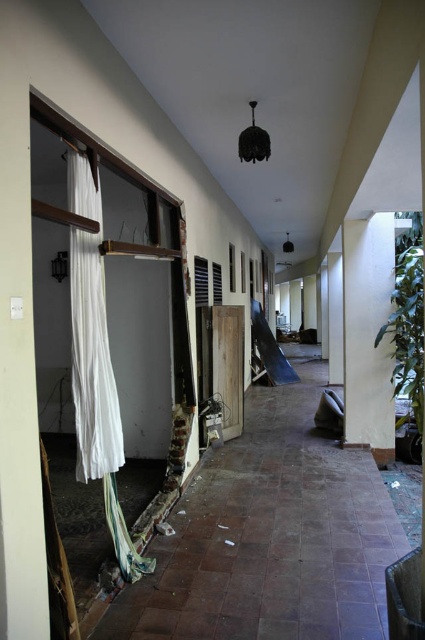
You are standing in the corridor and need to reach the exit located at the far end. There is a white fabric curtain at left. Is the curtain in your way if you walk straight towards the exit?

The white fabric curtain at left is positioned at point (96, 365), which is to the left side of the corridor. Since you are walking straight towards the exit, the curtain will not be directly in your path and therefore will not block your way.

You are a painter needing to hang a 2.5 meter tall canvas. You see the white fabric curtain at left and the green textured pillar at right in the corridor. Which object can accommodate the canvas height?

The green textured pillar at right has a greater height than the white fabric curtain at left, so it can accommodate the 2.5 meter tall canvas.

You are a maintenance worker with a 3.5 meter long ladder. You need to place the ladder between the white fabric curtain at left and the green textured pillar at right. Based on the scene, will the ladder fit horizontally between them?

The distance between the white fabric curtain at left and the green textured pillar at right is 3.29 meters. Since the ladder is 3.5 meters long, it will not fit horizontally between them as the space is shorter than the ladder.